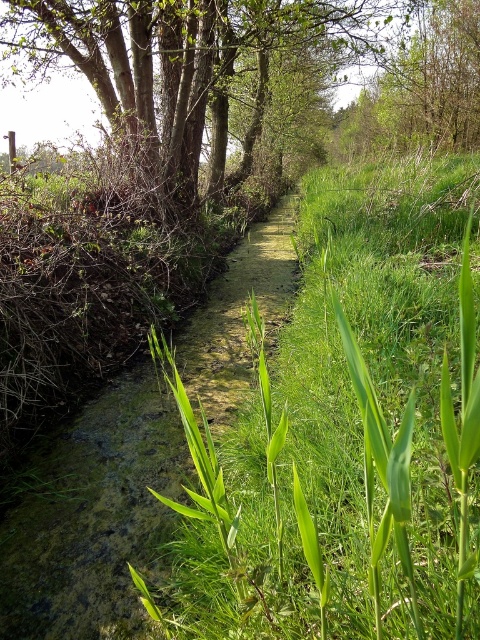
You are a gardener planning to mow the green leafy grass at center and trim the brown rough tree at upper left. Which task would require more time due to the size of the area or object?

The brown rough tree at upper left would require more time to trim because it occupies more space than the green leafy grass at center.

You are a hiker standing at the edge of the waterway and want to take a photo of both the green leafy grass at center and the brown rough tree at upper left. Can you see both objects clearly in the same frame without moving your camera?

The green leafy grass at center is in front of the brown rough tree at upper left, so the grass may block part of the tree in the photo. You might need to adjust your position to ensure both are visible.

You are a hiker trying to cross the waterway. You see the green leafy grass at center and the green leafy tree at upper center. Which object is closer to the ground?

The green leafy grass at center is located below the green leafy tree at upper center, so it is closer to the ground.